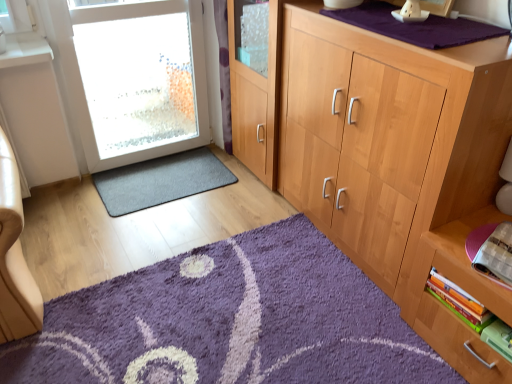
Question: Considering the relative sizes of white frosted glass door at left and green matte book at lower right, the 3th book in the top-to-bottom sequence, in the image provided, is white frosted glass door at left thinner than green matte book at lower right, the 3th book in the top-to-bottom sequence,?

Choices:
 (A) no
 (B) yes

Answer: (B)

Question: Can you see white frosted glass door at left touching green matte book at lower right, the 3th book in the top-to-bottom sequence?

Choices:
 (A) yes
 (B) no

Answer: (B)

Question: From the image's perspective, is white frosted glass door at left below green matte book at lower right, which is the first book from bottom to top?

Choices:
 (A) yes
 (B) no

Answer: (B)

Question: Does white frosted glass door at left have a smaller size compared to green matte book at lower right, which is the first book from bottom to top?

Choices:
 (A) no
 (B) yes

Answer: (A)

Question: From a real-world perspective, is white frosted glass door at left on top of green matte book at lower right, the 3th book in the top-to-bottom sequence?

Choices:
 (A) yes
 (B) no

Answer: (A)

Question: Is white frosted glass door at left facing towards green matte book at lower right, the 3th book in the top-to-bottom sequence?

Choices:
 (A) yes
 (B) no

Answer: (A)

Question: Is dark gray carpet at lower left, the second doormat when ordered from bottom to top, smaller than purple shaggy rug at lower center, the second doormat positioned from the back?

Choices:
 (A) yes
 (B) no

Answer: (A)

Question: Is dark gray carpet at lower left, which is the first doormat in top-to-bottom order, oriented towards purple shaggy rug at lower center, the second doormat positioned from the back?

Choices:
 (A) no
 (B) yes

Answer: (B)

Question: Can you confirm if dark gray carpet at lower left, which is the first doormat in top-to-bottom order, is shorter than purple shaggy rug at lower center, the second doormat positioned from the back?

Choices:
 (A) no
 (B) yes

Answer: (B)

Question: Is dark gray carpet at lower left, acting as the 2th doormat starting from the front, to the right of purple shaggy rug at lower center, the 1th doormat viewed from the front, from the viewer's perspective?

Choices:
 (A) yes
 (B) no

Answer: (B)

Question: From the image's perspective, is dark gray carpet at lower left, the second doormat when ordered from bottom to top, below purple shaggy rug at lower center, the 2th doormat from the top?

Choices:
 (A) yes
 (B) no

Answer: (B)

Question: Is dark gray carpet at lower left, the 1th doormat in the back-to-front sequence, next to purple shaggy rug at lower center, which appears as the 1th doormat when ordered from the bottom?

Choices:
 (A) no
 (B) yes

Answer: (A)

Question: From the image's perspective, does white frosted glass door at left appear lower than hardcover book at lower right, placed as the first book when sorted from top to bottom?

Choices:
 (A) yes
 (B) no

Answer: (B)